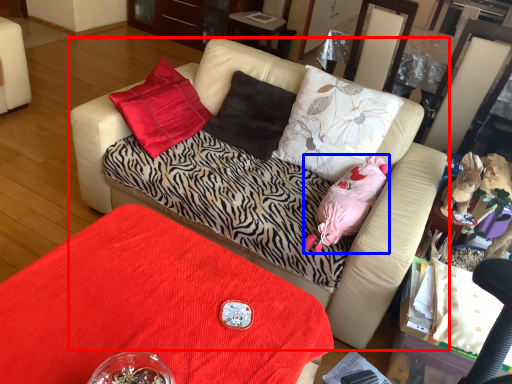
Question: Which point is further to the camera, studio couch (highlighted by a red box) or animal (highlighted by a blue box)?

Choices:
 (A) studio couch
 (B) animal

Answer: (B)